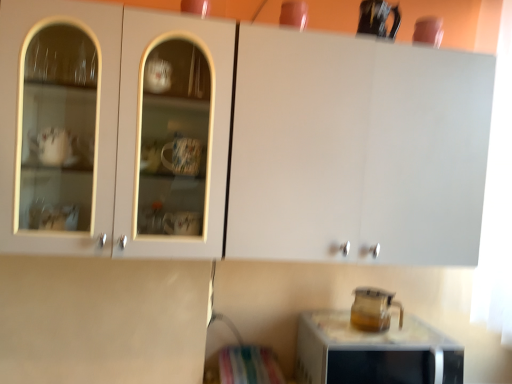
At what (x,y) coordinates should I click in order to perform the action: click on vacant region in front of transparent glass pitcher at lower right. Please return your answer as a coordinate pair (x, y). Image resolution: width=512 pixels, height=384 pixels. Looking at the image, I should click on (378, 347).